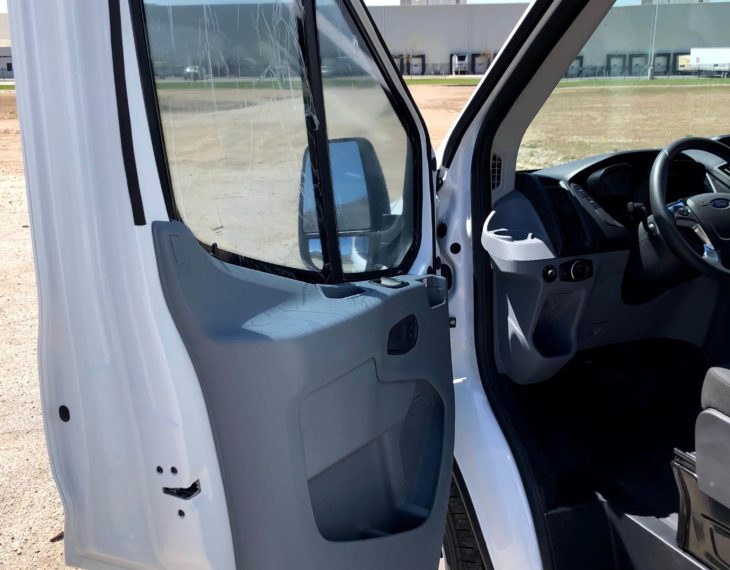
Locate an element on the screen. This screenshot has height=570, width=730. door is located at coordinates (126, 253), (223, 492).